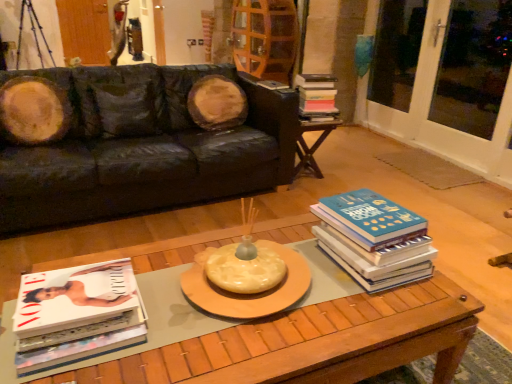
Find the location of `free spot in front of blue hardcover book at right, which is the 2th book from back to front`. free spot in front of blue hardcover book at right, which is the 2th book from back to front is located at coordinates (376, 312).